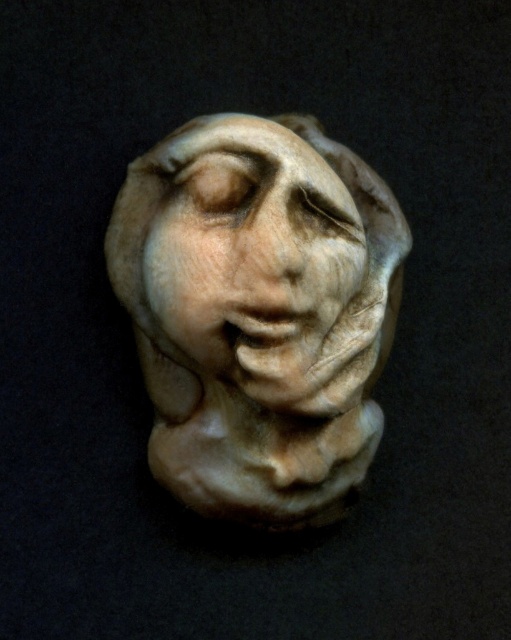
Does white marble sculpture at center lie in front of white marble face at center?

No.

Between point (359, 237) and point (270, 241), which one is positioned in front?

Point (270, 241) is in front.

Does point (291, 188) come in front of point (326, 275)?

Yes, point (291, 188) is in front of point (326, 275).

You are a GUI agent. You are given a task and a screenshot of the screen. Output one action in this format:
    pyautogui.click(x=<x>, y=<y>)
    Task: Click on the white marble sculpture at center
    The width and height of the screenshot is (511, 640).
    Given the screenshot: What is the action you would take?
    pyautogui.click(x=259, y=312)